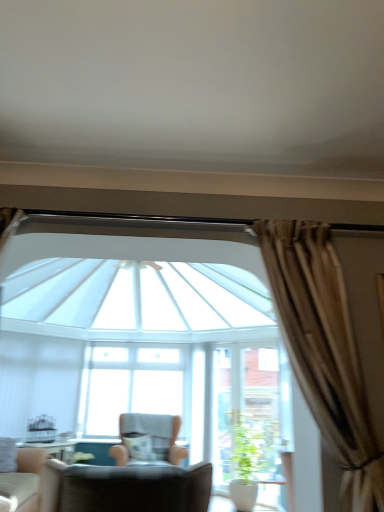
Question: From the image's perspective, does light beige fabric chair at lower left, the 2th chair in the front-to-back sequence, appear higher than transparent glass window at center?

Choices:
 (A) no
 (B) yes

Answer: (B)

Question: Is light beige fabric chair at lower left, marked as the 2th chair in a back-to-front arrangement, aimed at transparent glass window at center?

Choices:
 (A) no
 (B) yes

Answer: (A)

Question: Can transparent glass window at center be found inside light beige fabric chair at lower left, the 2th chair in the front-to-back sequence?

Choices:
 (A) yes
 (B) no

Answer: (B)

Question: Can you confirm if light beige fabric chair at lower left, the 2th chair in the front-to-back sequence, is shorter than transparent glass window at center?

Choices:
 (A) yes
 (B) no

Answer: (A)

Question: Is light beige fabric chair at lower left, the 2th chair in the front-to-back sequence, next to transparent glass window at center and touching it?

Choices:
 (A) no
 (B) yes

Answer: (A)

Question: Is light beige fabric chair at lower left, marked as the 2th chair in a back-to-front arrangement, not near transparent glass window at center?

Choices:
 (A) no
 (B) yes

Answer: (B)

Question: Does beige fabric chair at center, the 3th chair when ordered from front to back, turn towards transparent glass window at center?

Choices:
 (A) no
 (B) yes

Answer: (A)

Question: Is beige fabric chair at center, the 1th chair when ordered from back to front, closer to the viewer compared to transparent glass window at center?

Choices:
 (A) yes
 (B) no

Answer: (A)

Question: Can you confirm if beige fabric chair at center, the 1th chair when ordered from back to front, is wider than transparent glass window at center?

Choices:
 (A) no
 (B) yes

Answer: (B)

Question: Is the depth of beige fabric chair at center, the 1th chair when ordered from back to front, greater than that of transparent glass window at center?

Choices:
 (A) no
 (B) yes

Answer: (A)

Question: Is beige fabric chair at center, the 3th chair when ordered from front to back, outside of transparent glass window at center?

Choices:
 (A) yes
 (B) no

Answer: (A)

Question: From a real-world perspective, does beige fabric chair at center, the 1th chair when ordered from back to front, stand above transparent glass window at center?

Choices:
 (A) no
 (B) yes

Answer: (A)

Question: Can you confirm if light beige fabric chair at lower left, the 2th chair in the front-to-back sequence, is positioned to the left of beige fabric chair at center, the 1th chair when ordered from back to front?

Choices:
 (A) no
 (B) yes

Answer: (B)